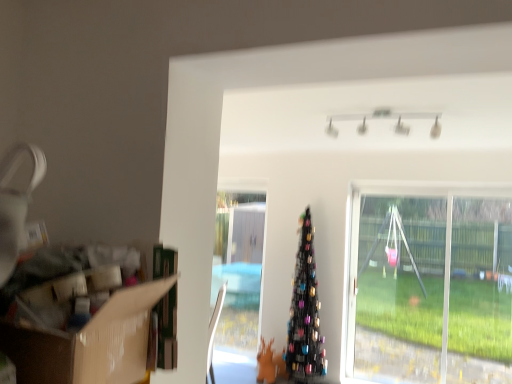
Question: Does transparent plastic swing at right touch black metallic christmas tree at center?

Choices:
 (A) no
 (B) yes

Answer: (A)

Question: Is transparent plastic swing at right aimed at black metallic christmas tree at center?

Choices:
 (A) yes
 (B) no

Answer: (B)

Question: Is black metallic christmas tree at center a part of transparent plastic swing at right?

Choices:
 (A) yes
 (B) no

Answer: (B)

Question: Can you confirm if transparent plastic swing at right is taller than black metallic christmas tree at center?

Choices:
 (A) yes
 (B) no

Answer: (A)

Question: Does transparent plastic swing at right have a lesser width compared to black metallic christmas tree at center?

Choices:
 (A) yes
 (B) no

Answer: (A)

Question: From the image's perspective, would you say transparent plastic swing at right is positioned over black metallic christmas tree at center?

Choices:
 (A) yes
 (B) no

Answer: (A)

Question: Can cardboard box at left be found inside black metallic christmas tree at center?

Choices:
 (A) no
 (B) yes

Answer: (A)

Question: Can you confirm if black metallic christmas tree at center is smaller than cardboard box at left?

Choices:
 (A) yes
 (B) no

Answer: (B)

Question: From the image's perspective, would you say black metallic christmas tree at center is positioned over cardboard box at left?

Choices:
 (A) yes
 (B) no

Answer: (B)

Question: Can you confirm if black metallic christmas tree at center is shorter than cardboard box at left?

Choices:
 (A) yes
 (B) no

Answer: (B)

Question: Is black metallic christmas tree at center at the left side of cardboard box at left?

Choices:
 (A) no
 (B) yes

Answer: (A)

Question: Is black metallic christmas tree at center turned away from cardboard box at left?

Choices:
 (A) yes
 (B) no

Answer: (B)

Question: Is cardboard box at left shorter than transparent plastic swing at right?

Choices:
 (A) no
 (B) yes

Answer: (B)